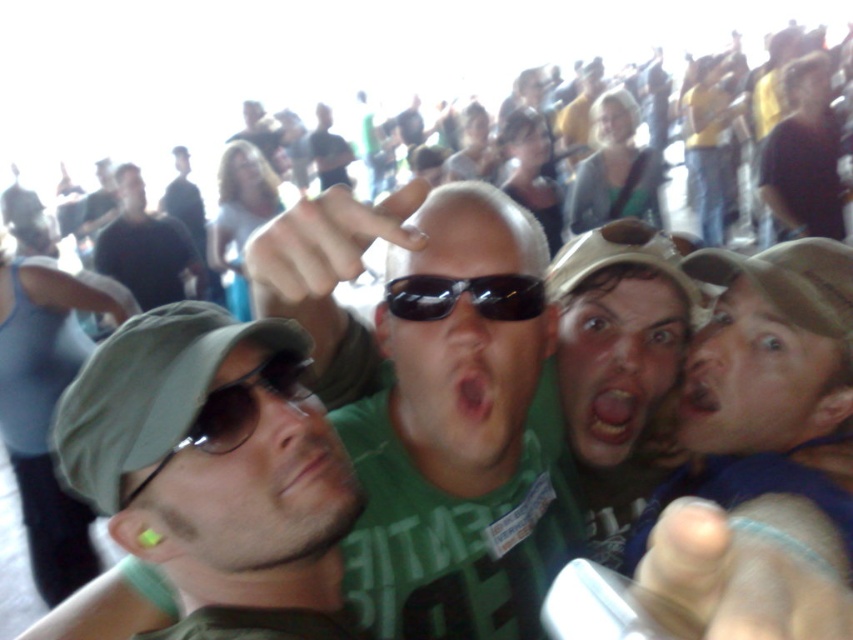
Consider the image. Is green matte cap at left thinner than dark gray cap at left?

Yes, green matte cap at left is thinner than dark gray cap at left.

Is point (125, 467) positioned in front of point (166, 273)?

Yes, point (125, 467) is in front of point (166, 273).

Find the location of a particular element. The height and width of the screenshot is (640, 853). green matte cap at left is located at coordinates (212, 458).

Is green matte cap at left closer to the viewer compared to sunglasses at center?

Yes, green matte cap at left is in front of sunglasses at center.

Based on the photo, which of these two, green matte cap at left or sunglasses at center, stands shorter?

sunglasses at center is shorter.

What are the coordinates of `green matte cap at left` in the screenshot? It's located at (212, 458).

Locate an element on the screen. This screenshot has width=853, height=640. green matte cap at left is located at coordinates (212, 458).

Can you confirm if green matte cap at left is bigger than sunglasses at left?

Indeed, green matte cap at left has a larger size compared to sunglasses at left.

Can you confirm if green matte cap at left is shorter than sunglasses at left?

No, green matte cap at left is not shorter than sunglasses at left.

Find the location of a particular element. This screenshot has height=640, width=853. green matte cap at left is located at coordinates (212, 458).